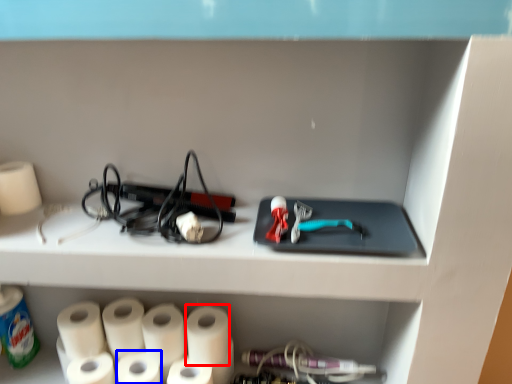
Question: Which object appears closest to the camera in this image, paper towel (highlighted by a red box) or paper towel (highlighted by a blue box)?

Choices:
 (A) paper towel
 (B) paper towel

Answer: (B)